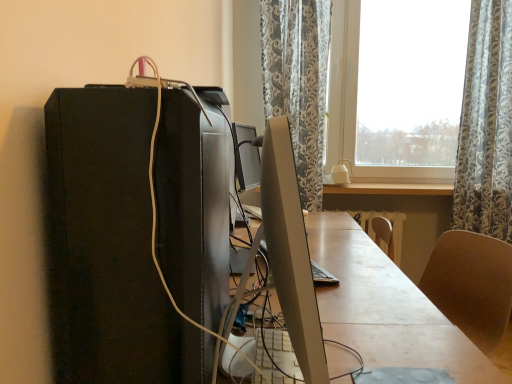
Question: Considering the relative sizes of light wood table at center and smooth wooden desk at center in the image provided, is light wood table at center smaller than smooth wooden desk at center?

Choices:
 (A) yes
 (B) no

Answer: (A)

Question: Would you say light wood table at center is outside smooth wooden desk at center?

Choices:
 (A) no
 (B) yes

Answer: (B)

Question: From the image's perspective, would you say light wood table at center is positioned over smooth wooden desk at center?

Choices:
 (A) no
 (B) yes

Answer: (B)

Question: Is light wood table at center oriented towards smooth wooden desk at center?

Choices:
 (A) no
 (B) yes

Answer: (A)

Question: Is light wood table at center positioned behind smooth wooden desk at center?

Choices:
 (A) no
 (B) yes

Answer: (B)

Question: From a real-world perspective, is light wood table at center on smooth wooden desk at center?

Choices:
 (A) no
 (B) yes

Answer: (B)

Question: Could you tell me if black matte computer tower at left is facing satin silver monitor at center?

Choices:
 (A) yes
 (B) no

Answer: (A)

Question: Does black matte computer tower at left have a greater height compared to satin silver monitor at center?

Choices:
 (A) no
 (B) yes

Answer: (B)

Question: Does black matte computer tower at left have a lesser height compared to satin silver monitor at center?

Choices:
 (A) yes
 (B) no

Answer: (B)

Question: Considering the relative sizes of black matte computer tower at left and satin silver monitor at center in the image provided, is black matte computer tower at left thinner than satin silver monitor at center?

Choices:
 (A) no
 (B) yes

Answer: (A)

Question: From a real-world perspective, is black matte computer tower at left over satin silver monitor at center?

Choices:
 (A) no
 (B) yes

Answer: (B)

Question: From the image's perspective, would you say black matte computer tower at left is shown under satin silver monitor at center?

Choices:
 (A) no
 (B) yes

Answer: (A)

Question: Is light wood table at center oriented away from satin silver monitor at center?

Choices:
 (A) yes
 (B) no

Answer: (B)